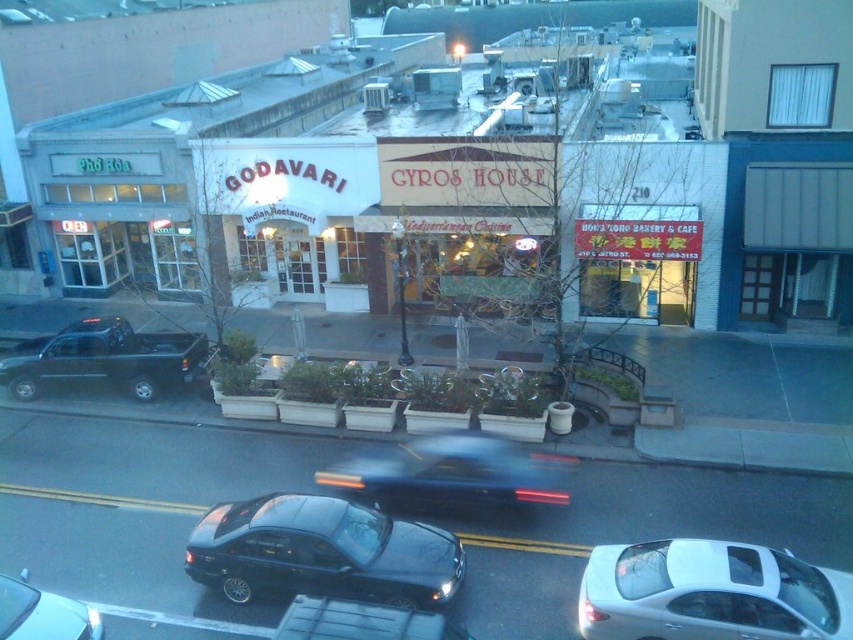
You are a delivery driver needing to park your car between the black matte truck at left and the shiny black sedan at lower left. The parking spot requires a minimum distance of 30 feet between vehicles. Can you park there?

The distance between the black matte truck at left and the shiny black sedan at lower left is 29.84 feet, which is less than the required 30 feet. Therefore, you cannot park there as it does not meet the parking spot requirements.

You are standing on the street and want to walk from point (207, 342) to point (57, 602). Which direction should you face to move towards your destination?

You should face towards the bottom right direction because point (57, 602) is located further away from the viewer compared to point (207, 342).

You are a pedestrian standing at the crosswalk and want to cross the street. You see a metallic blue sedan at center and a black matte truck at left. Which vehicle is closer to the crosswalk?

The metallic blue sedan at center is positioned on the right side of the black matte truck at left, meaning the truck is closer to the crosswalk than the sedan.